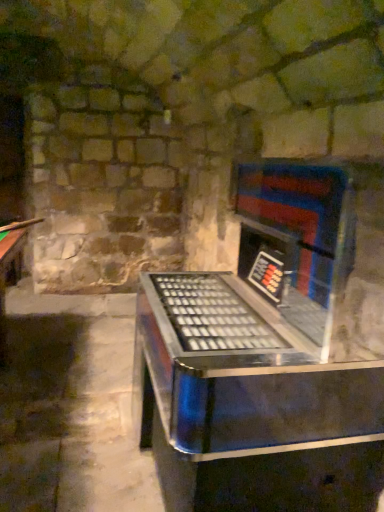
Question: From the image's perspective, does brushed metal cue at left appear lower than metallic/reflective jukebox at center?

Choices:
 (A) yes
 (B) no

Answer: (B)

Question: Is brushed metal cue at left beside metallic/reflective jukebox at center?

Choices:
 (A) no
 (B) yes

Answer: (A)

Question: Considering the relative sizes of brushed metal cue at left and metallic/reflective jukebox at center in the image provided, is brushed metal cue at left wider than metallic/reflective jukebox at center?

Choices:
 (A) no
 (B) yes

Answer: (A)

Question: Is brushed metal cue at left bigger than metallic/reflective jukebox at center?

Choices:
 (A) yes
 (B) no

Answer: (B)

Question: Considering the relative positions of brushed metal cue at left and metallic/reflective jukebox at center in the image provided, is brushed metal cue at left in front of metallic/reflective jukebox at center?

Choices:
 (A) yes
 (B) no

Answer: (B)

Question: Would you say metallic/reflective jukebox at center is part of brushed metal cue at left's contents?

Choices:
 (A) no
 (B) yes

Answer: (A)

Question: Does metallic/reflective jukebox at center lie in front of brushed metal cue at left?

Choices:
 (A) yes
 (B) no

Answer: (A)

Question: Is there a large distance between metallic/reflective jukebox at center and brushed metal cue at left?

Choices:
 (A) yes
 (B) no

Answer: (A)

Question: Is metallic/reflective jukebox at center touching brushed metal cue at left?

Choices:
 (A) no
 (B) yes

Answer: (A)

Question: From a real-world perspective, does metallic/reflective jukebox at center stand above brushed metal cue at left?

Choices:
 (A) yes
 (B) no

Answer: (B)

Question: From the image's perspective, is metallic/reflective jukebox at center over brushed metal cue at left?

Choices:
 (A) yes
 (B) no

Answer: (B)

Question: From a real-world perspective, is metallic/reflective jukebox at center positioned under brushed metal cue at left based on gravity?

Choices:
 (A) no
 (B) yes

Answer: (B)

Question: Relative to metallic/reflective jukebox at center, is brushed metal cue at left in front or behind?

Choices:
 (A) front
 (B) behind

Answer: (B)